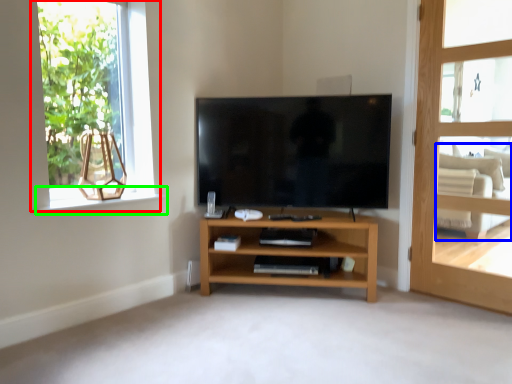
Question: Which object is the farthest from window (highlighted by a red box)? Choose among these: armchair (highlighted by a blue box) or window sill (highlighted by a green box).

Choices:
 (A) armchair
 (B) window sill

Answer: (A)